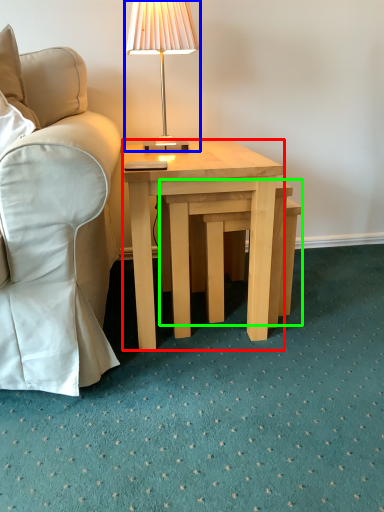
Question: Considering the real-world distances, which object is closest to coffee table (highlighted by a red box)? lamp (highlighted by a blue box) or step stool (highlighted by a green box).

Choices:
 (A) lamp
 (B) step stool

Answer: (B)